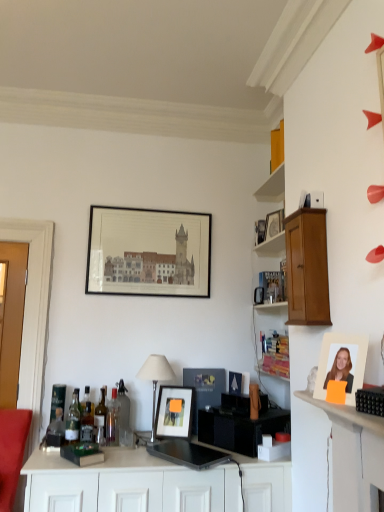
What are the coordinates of `vacant space situated above matte black picture frame at upper center, positioned as the 1th picture frame in top-to-bottom order (from a real-world perspective)` in the screenshot? It's located at (150, 209).